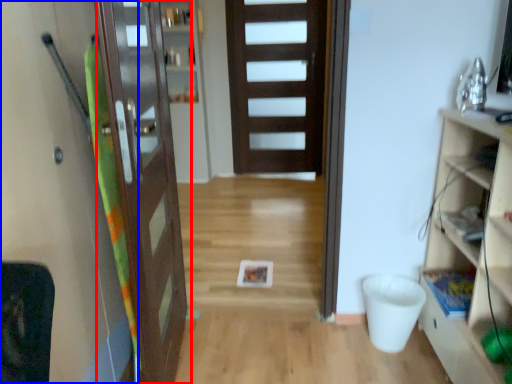
Question: Which object is closer to the camera taking this photo, door (highlighted by a red box) or screen door (highlighted by a blue box)?

Choices:
 (A) door
 (B) screen door

Answer: (B)